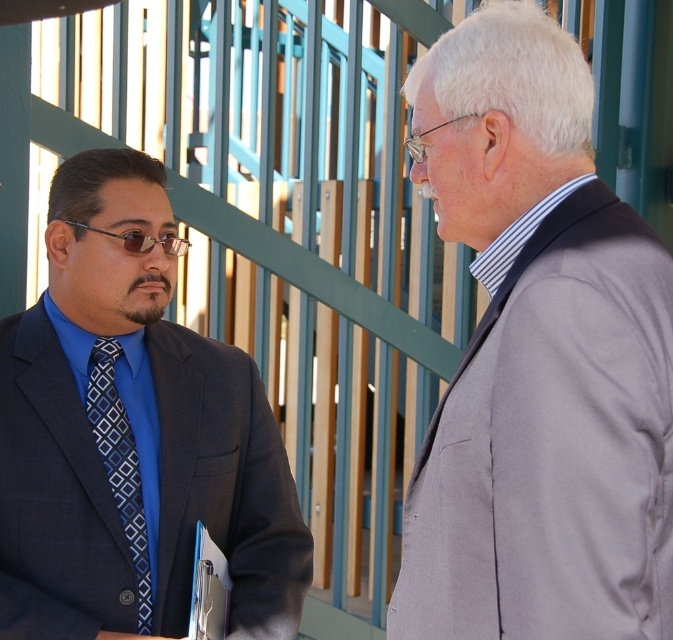
Question: Is matte black suit at left below blue diamond-patterned tie at left?

Choices:
 (A) yes
 (B) no

Answer: (B)

Question: Among these points, which one is farthest from the camera?

Choices:
 (A) (104, 428)
 (B) (145, 273)
 (C) (637, 512)

Answer: (B)

Question: Observing the image, what is the correct spatial positioning of matte black suit at left in reference to blue diamond-patterned tie at left?

Choices:
 (A) left
 (B) right

Answer: (A)

Question: Which point is closer to the camera?

Choices:
 (A) (118, 403)
 (B) (579, 385)
 (C) (149, 474)

Answer: (B)

Question: Does gray wool suit at right have a greater width compared to matte black suit at left?

Choices:
 (A) yes
 (B) no

Answer: (B)

Question: Which of these objects is positioned closest to the blue diamond-patterned tie at left?

Choices:
 (A) gray wool suit at right
 (B) matte black suit at left

Answer: (B)